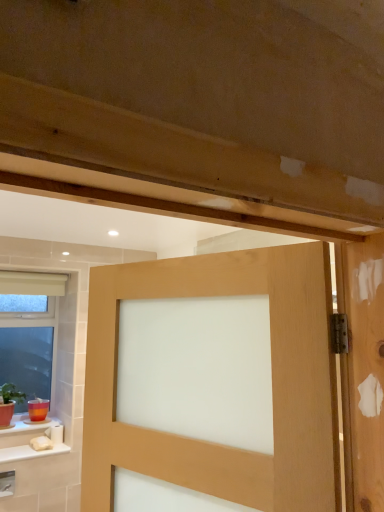
The width and height of the screenshot is (384, 512). Describe the element at coordinates (29, 333) in the screenshot. I see `transparent glass window at lower left` at that location.

From the picture: What is the approximate width of transparent glass window at lower left?

transparent glass window at lower left is 11.36 centimeters in width.

This screenshot has height=512, width=384. In order to click on transparent glass window at lower left in this screenshot , I will do `click(29, 333)`.

You are a GUI agent. You are given a task and a screenshot of the screen. Output one action in this format:
    pyautogui.click(x=<x>, y=<y>)
    Task: Click on the satin wood door at center
    This screenshot has width=384, height=512.
    Given the screenshot: What is the action you would take?
    pyautogui.click(x=272, y=383)

The height and width of the screenshot is (512, 384). What do you see at coordinates (272, 383) in the screenshot?
I see `satin wood door at center` at bounding box center [272, 383].

This screenshot has height=512, width=384. In order to click on transparent glass window at lower left in this screenshot , I will do [x=29, y=333].

Which is more to the right, transparent glass window at lower left or satin wood door at center?

satin wood door at center.

Is transparent glass window at lower left in front of satin wood door at center?

No.

Looking at this image, which point is more forward, (60,275) or (208,265)?

Positioned in front is point (208,265).

From the image's perspective, is transparent glass window at lower left positioned above or below satin wood door at center?

Based on their image positions, transparent glass window at lower left is located beneath satin wood door at center.

From a real-world perspective, is transparent glass window at lower left under satin wood door at center?

Indeed, from a real-world perspective, transparent glass window at lower left is positioned beneath satin wood door at center.

Considering the relative sizes of transparent glass window at lower left and satin wood door at center in the image provided, is transparent glass window at lower left thinner than satin wood door at center?

Indeed, transparent glass window at lower left has a lesser width compared to satin wood door at center.

Which of these two, transparent glass window at lower left or satin wood door at center, stands shorter?

satin wood door at center.

Which of these two, transparent glass window at lower left or satin wood door at center, is bigger?

With larger size is satin wood door at center.

Can we say transparent glass window at lower left lies outside satin wood door at center?

Absolutely, transparent glass window at lower left is external to satin wood door at center.

Would you say transparent glass window at lower left is a long distance from satin wood door at center?

Absolutely, transparent glass window at lower left is distant from satin wood door at center.

Is transparent glass window at lower left positioned with its back to satin wood door at center?

transparent glass window at lower left is not turned away from satin wood door at center.

What's the angular difference between transparent glass window at lower left and satin wood door at center's facing directions?

A: 72.7 degrees.

The width and height of the screenshot is (384, 512). What are the coordinates of `window located underneath the satin wood door at center (from a real-world perspective)` in the screenshot? It's located at (29, 333).

Which is more to the right, satin wood door at center or transparent glass window at lower left?

Positioned to the right is satin wood door at center.

Is satin wood door at center in front of or behind transparent glass window at lower left in the image?

Clearly, satin wood door at center is in front of transparent glass window at lower left.

Does point (124, 461) come behind point (38, 301)?

No, it is in front of (38, 301).

From the image's perspective, is satin wood door at center positioned above or below transparent glass window at lower left?

satin wood door at center is above transparent glass window at lower left.

From a real-world perspective, is satin wood door at center on transparent glass window at lower left?

Yes, from a real-world perspective, satin wood door at center is over transparent glass window at lower left

Considering the sizes of objects satin wood door at center and transparent glass window at lower left in the image provided, who is wider, satin wood door at center or transparent glass window at lower left?

satin wood door at center.

Is satin wood door at center taller than transparent glass window at lower left?

No.

Is satin wood door at center smaller than transparent glass window at lower left?

Actually, satin wood door at center might be larger than transparent glass window at lower left.

Based on the photo, is transparent glass window at lower left surrounded by satin wood door at center?

No, transparent glass window at lower left is not a part of satin wood door at center.

Is satin wood door at center next to transparent glass window at lower left?

No, satin wood door at center is not next to transparent glass window at lower left.

Consider the image. Is satin wood door at center oriented away from transparent glass window at lower left?

No, satin wood door at center's orientation is not away from transparent glass window at lower left.

From the picture: How different are the orientations of satin wood door at center and transparent glass window at lower left in degrees?

They differ by 72.7 degrees in their facing directions.

Identify the location of door that appears above the transparent glass window at lower left (from the image's perspective). (272, 383).

Locate an element on the screen. door in front of the transparent glass window at lower left is located at coordinates (272, 383).

I want to click on window below the satin wood door at center (from the image's perspective), so click(29, 333).